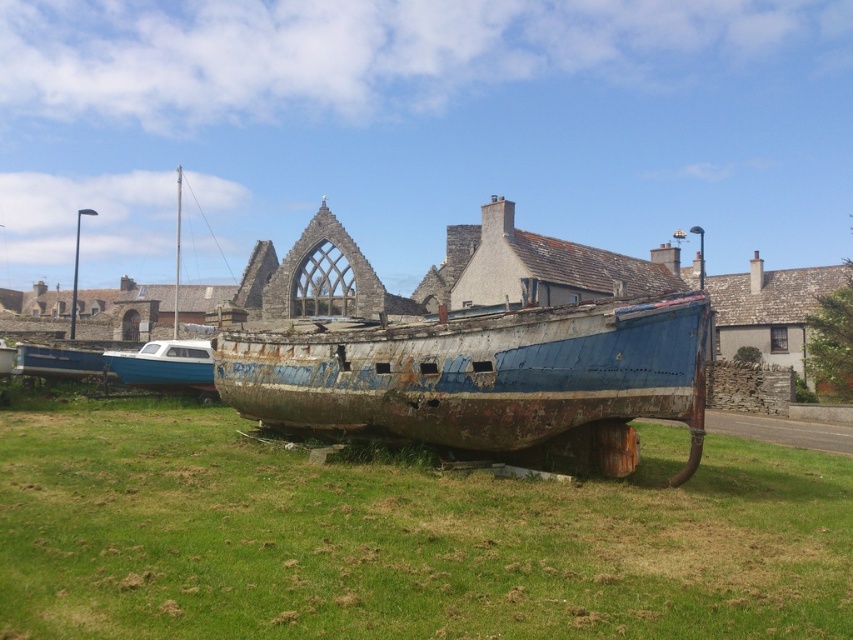
Question: Which point is closer to the camera?

Choices:
 (A) [123, 365]
 (B) [532, 396]
 (C) [67, 369]
 (D) [140, 621]

Answer: (D)

Question: Is blue painted wood boat at left below rusty metal boat at lower left?

Choices:
 (A) yes
 (B) no

Answer: (B)

Question: Is green grassy at center above rusty metal boat at center?

Choices:
 (A) no
 (B) yes

Answer: (A)

Question: Which point is closer to the camera taking this photo?

Choices:
 (A) (717, 486)
 (B) (550, 326)
 (C) (138, 360)

Answer: (B)

Question: Which object appears closest to the camera in this image?

Choices:
 (A) green grassy at center
 (B) blue painted wood boat at left
 (C) rusty metal boat at center
 (D) rusty metal boat at lower left

Answer: (A)

Question: From the image, what is the correct spatial relationship of green grassy at center in relation to rusty metal boat at center?

Choices:
 (A) above
 (B) below

Answer: (B)